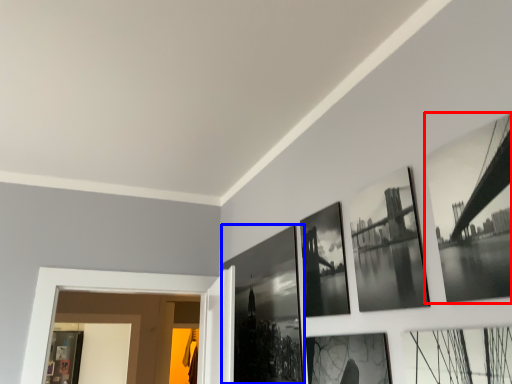
Question: Which object is further to the camera taking this photo, picture frame (highlighted by a red box) or picture frame (highlighted by a blue box)?

Choices:
 (A) picture frame
 (B) picture frame

Answer: (B)